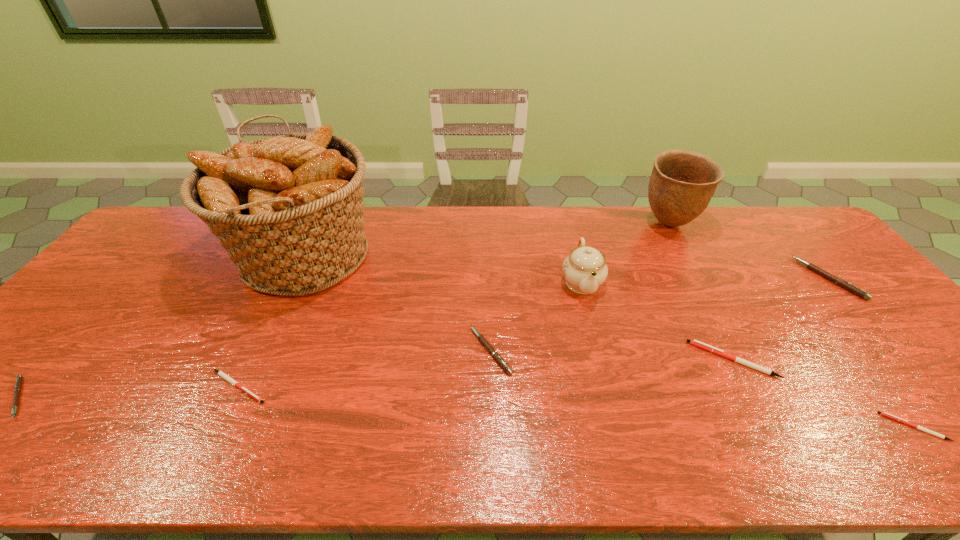
At what (x,y) coordinates should I click in order to perform the action: click on basket. Please return your answer as a coordinate pair (x, y). The height and width of the screenshot is (540, 960). Looking at the image, I should click on (288, 209).

This screenshot has width=960, height=540. I want to click on pottery, so click(682, 183).

Find the location of a particular element. the fifth object from left to right is located at coordinates (585, 269).

Image resolution: width=960 pixels, height=540 pixels. I want to click on the seventh shortest object, so click(585, 269).

Image resolution: width=960 pixels, height=540 pixels. Find the location of `the farthest pink pen`. the farthest pink pen is located at coordinates (844, 284).

Where is `the tallest pen`? the tallest pen is located at coordinates (844, 284).

The image size is (960, 540). I want to click on the third pen from left to right, so click(x=495, y=354).

The height and width of the screenshot is (540, 960). What are the coordinates of `the fourth object from left to right` in the screenshot? It's located at (495, 354).

This screenshot has width=960, height=540. Identify the location of the second white pen from left to right. pyautogui.click(x=694, y=342).

Identify the location of the biggest white pen. This screenshot has width=960, height=540. (694, 342).